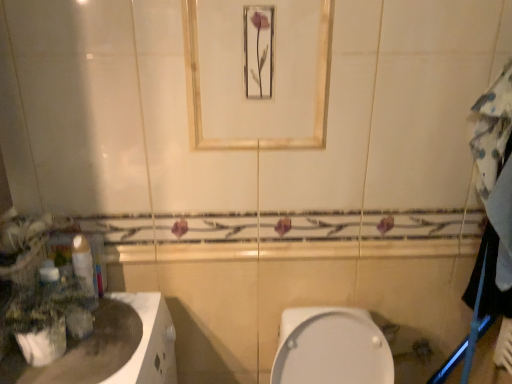
Where is `vacant area that lies in front of white glossy toilet paper at left`? vacant area that lies in front of white glossy toilet paper at left is located at coordinates (78, 359).